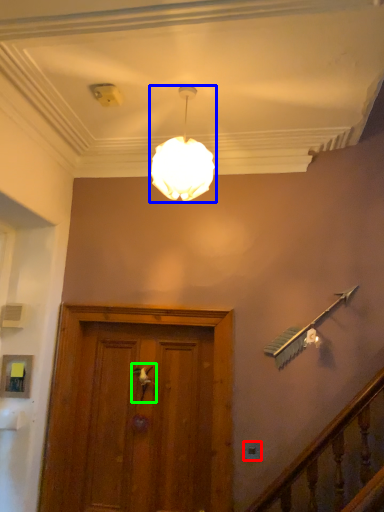
Question: Which object is positioned farthest from electric outlet (highlighted by a red box)? Select from lamp (highlighted by a blue box) and door handle (highlighted by a green box).

Choices:
 (A) lamp
 (B) door handle

Answer: (A)